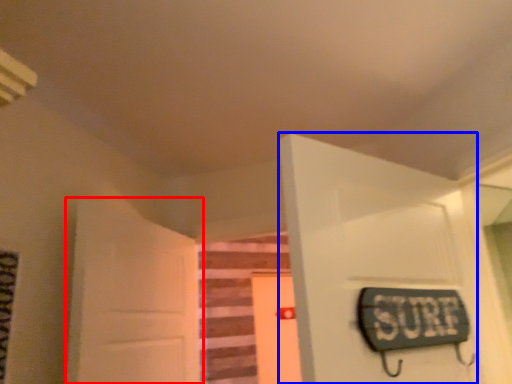
Question: Which object is further to the camera taking this photo, door (highlighted by a red box) or door (highlighted by a blue box)?

Choices:
 (A) door
 (B) door

Answer: (A)